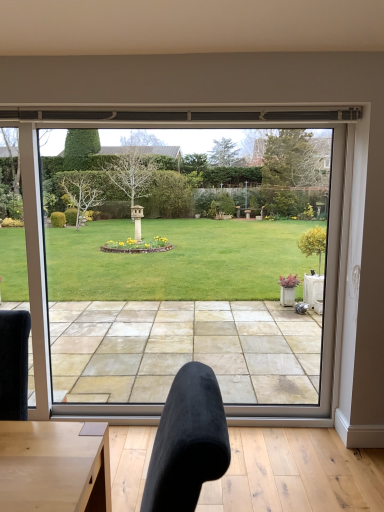
Where is `clear glass window at center`? clear glass window at center is located at coordinates (207, 302).

What do you see at coordinates (207, 302) in the screenshot? I see `clear glass window at center` at bounding box center [207, 302].

Where is `clear glass window at center`? The image size is (384, 512). clear glass window at center is located at coordinates (207, 302).